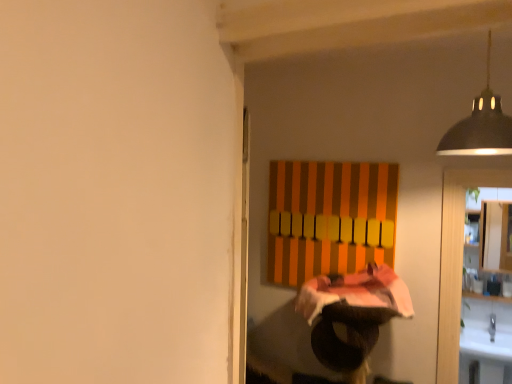
In order to face white glossy cabinet at right, should I rotate leftwards or rightwards?

Turn right approximately 29.106 degrees to face it.

Locate an element on the screen. white glossy cabinet at right is located at coordinates (496, 236).

What do you see at coordinates (496, 236) in the screenshot? This screenshot has height=384, width=512. I see `white glossy cabinet at right` at bounding box center [496, 236].

What do you see at coordinates (480, 125) in the screenshot?
I see `black metal lampshade at upper right` at bounding box center [480, 125].

I want to click on black metal lampshade at upper right, so click(x=480, y=125).

This screenshot has width=512, height=384. I want to click on white glossy cabinet at right, so click(496, 236).

Which is more to the right, white glossy cabinet at right or black metal lampshade at upper right?

white glossy cabinet at right is more to the right.

From the picture: Is white glossy cabinet at right further to camera compared to black metal lampshade at upper right?

Yes, it is.

Is point (489, 251) farther from camera compared to point (484, 137)?

Yes, point (489, 251) is behind point (484, 137).

From the image's perspective, which object appears higher, white glossy cabinet at right or black metal lampshade at upper right?

black metal lampshade at upper right, from the image's perspective.

From a real-world perspective, who is located higher, white glossy cabinet at right or black metal lampshade at upper right?

black metal lampshade at upper right, from a real-world perspective.

Considering the sizes of white glossy cabinet at right and black metal lampshade at upper right in the image, is white glossy cabinet at right wider or thinner than black metal lampshade at upper right?

In the image, white glossy cabinet at right appears to be more narrow than black metal lampshade at upper right.

Which of these two, white glossy cabinet at right or black metal lampshade at upper right, stands shorter?

With less height is black metal lampshade at upper right.

Considering the sizes of objects white glossy cabinet at right and black metal lampshade at upper right in the image provided, who is smaller, white glossy cabinet at right or black metal lampshade at upper right?

With smaller size is black metal lampshade at upper right.

Is black metal lampshade at upper right completely or partially inside white glossy cabinet at right?

No.

Would you consider white glossy cabinet at right to be distant from black metal lampshade at upper right?

Absolutely, white glossy cabinet at right is distant from black metal lampshade at upper right.

Is white glossy cabinet at right facing towards black metal lampshade at upper right?

Yes, white glossy cabinet at right is turned towards black metal lampshade at upper right.

What's the angular difference between white glossy cabinet at right and black metal lampshade at upper right's facing directions?

178 degrees separate the facing orientations of white glossy cabinet at right and black metal lampshade at upper right.

Identify the location of lamp above the white glossy cabinet at right (from a real-world perspective). (480, 125).

Can you confirm if black metal lampshade at upper right is positioned to the left of white glossy cabinet at right?

Yes.

In the scene shown: Which is behind, black metal lampshade at upper right or white glossy cabinet at right?

white glossy cabinet at right is behind.

Which is more distant, (454, 155) or (482, 256)?

Point (482, 256)

From the image's perspective, is black metal lampshade at upper right below white glossy cabinet at right?

No.

From a real-world perspective, between black metal lampshade at upper right and white glossy cabinet at right, who is vertically higher?

In real-world perspective, black metal lampshade at upper right is above.

Which object is wider, black metal lampshade at upper right or white glossy cabinet at right?

With larger width is black metal lampshade at upper right.

Is black metal lampshade at upper right shorter than white glossy cabinet at right?

Indeed, black metal lampshade at upper right has a lesser height compared to white glossy cabinet at right.

Between black metal lampshade at upper right and white glossy cabinet at right, which one has smaller size?

Smaller between the two is black metal lampshade at upper right.

Do you think black metal lampshade at upper right is within white glossy cabinet at right, or outside of it?

black metal lampshade at upper right is spatially situated outside white glossy cabinet at right.

Is black metal lampshade at upper right not close to white glossy cabinet at right?

That's right, there is a large distance between black metal lampshade at upper right and white glossy cabinet at right.

Does black metal lampshade at upper right turn towards white glossy cabinet at right?

Yes, black metal lampshade at upper right faces towards white glossy cabinet at right.

This screenshot has height=384, width=512. In the image, there is a black metal lampshade at upper right. Find the location of `cabinetry below it (from the image's perspective)`. cabinetry below it (from the image's perspective) is located at coordinates (496, 236).

The height and width of the screenshot is (384, 512). Find the location of `lamp on the left of white glossy cabinet at right`. lamp on the left of white glossy cabinet at right is located at coordinates (480, 125).

Image resolution: width=512 pixels, height=384 pixels. Find the location of `cabinetry located on the right of black metal lampshade at upper right`. cabinetry located on the right of black metal lampshade at upper right is located at coordinates (496, 236).